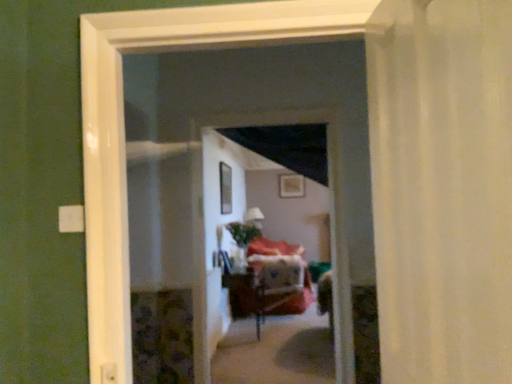
You are a GUI agent. You are given a task and a screenshot of the screen. Output one action in this format:
    pyautogui.click(x=<x>, y=<y>)
    Task: Click on the wooden table at center
    This screenshot has height=384, width=512.
    Given the screenshot: What is the action you would take?
    pyautogui.click(x=274, y=282)

What is the approximate width of wooden table at center?

The width of wooden table at center is 75.75 centimeters.

Where is `white sheer curtain at right`? Image resolution: width=512 pixels, height=384 pixels. white sheer curtain at right is located at coordinates tap(442, 187).

What do you see at coordinates (330, 220) in the screenshot? The width and height of the screenshot is (512, 384). I see `wooden screen door at center` at bounding box center [330, 220].

Identify the location of transparent glass window at center. (225, 188).

You are a GUI agent. You are given a task and a screenshot of the screen. Output one action in this format:
    pyautogui.click(x=<x>, y=<y>)
    Task: Click on the wooden table at center
    
    Given the screenshot: What is the action you would take?
    pyautogui.click(x=274, y=282)

Is green matte plant at center taller or shorter than wooden picture frame at upper center?

Considering their sizes, green matte plant at center has more height than wooden picture frame at upper center.

Based on the photo, in the image, is green matte plant at center positioned in front of or behind wooden picture frame at upper center?

green matte plant at center is positioned closer to the viewer than wooden picture frame at upper center.

Can we say green matte plant at center lies outside wooden picture frame at upper center?

Indeed, green matte plant at center is completely outside wooden picture frame at upper center.

Is point (227, 228) closer or farther from the camera than point (291, 190)?

Point (227, 228) is positioned closer to the camera compared to point (291, 190).

From a real-world perspective, is wooden picture frame at upper center beneath wooden screen door at center?

No.

Are wooden picture frame at upper center and wooden screen door at center beside each other?

They are not placed beside each other.

How far apart are wooden picture frame at upper center and wooden screen door at center?

wooden picture frame at upper center and wooden screen door at center are 3.59 meters apart from each other.

Is wooden screen door at center oriented away from transparent glass window at center?

Yes, wooden screen door at center is facing away from transparent glass window at center.

In terms of width, does wooden screen door at center look wider or thinner when compared to transparent glass window at center?

In the image, wooden screen door at center appears to be wider than transparent glass window at center.

Is wooden screen door at center to the left or to the right of transparent glass window at center in the image?

wooden screen door at center is to the right of transparent glass window at center.

Is wooden screen door at center taller than transparent glass window at center?

Indeed, wooden screen door at center has a greater height compared to transparent glass window at center.

Can you confirm if green matte plant at center is positioned to the right of wooden screen door at center?

No.

Which of these two, green matte plant at center or wooden screen door at center, is smaller?

green matte plant at center is smaller.

Locate an element on the screen. The height and width of the screenshot is (384, 512). plant behind the wooden screen door at center is located at coordinates (243, 232).

Could wooden screen door at center be considered to be inside green matte plant at center?

Actually, wooden screen door at center is outside green matte plant at center.

At what (x,y) coordinates should I click in order to perform the action: click on furniture below the white sheer curtain at right (from the image's perspective). Please return your answer as a coordinate pair (x, y). The width and height of the screenshot is (512, 384). Looking at the image, I should click on (274, 282).

Could you tell me if wooden table at center is turned towards white sheer curtain at right?

No, wooden table at center is not facing towards white sheer curtain at right.

Is wooden table at center directly adjacent to white sheer curtain at right?

No, wooden table at center is not next to white sheer curtain at right.

From the image's perspective, which one is positioned lower, wooden table at center or white sheer curtain at right?

wooden table at center.

Considering the positions of point (278, 291) and point (237, 117), is point (278, 291) closer or farther from the camera than point (237, 117)?

Clearly, point (278, 291) is more distant from the camera than point (237, 117).

Is wooden table at center with wooden screen door at center?

No, wooden table at center is not next to wooden screen door at center.

Would you say wooden screen door at center is part of wooden table at center's contents?

No, wooden table at center does not contain wooden screen door at center.

Considering the relative positions of green matte plant at center and transparent glass window at center in the image provided, is green matte plant at center to the left of transparent glass window at center from the viewer's perspective?

No, green matte plant at center is not to the left of transparent glass window at center.

From a real-world perspective, is green matte plant at center positioned over transparent glass window at center based on gravity?

No, from a real-world perspective, green matte plant at center is not over transparent glass window at center

How different are the orientations of green matte plant at center and transparent glass window at center in degrees?

They differ by 4.1 degrees in their facing directions.

Locate an element on the screen. The width and height of the screenshot is (512, 384). plant in front of the wooden picture frame at upper center is located at coordinates (243, 232).

This screenshot has height=384, width=512. What are the coordinates of `screen door on the left of wooden picture frame at upper center` in the screenshot? It's located at (330, 220).

Estimate the real-world distances between objects in this image. Which object is further from green matte plant at center, transparent glass window at center or white sheer curtain at right?

white sheer curtain at right is further to green matte plant at center.

When comparing their distances from wooden table at center, does wooden screen door at center or wooden picture frame at upper center seem further?

wooden screen door at center is further to wooden table at center.

When comparing their distances from transparent glass window at center, does wooden picture frame at upper center or white sheer curtain at right seem closer?

wooden picture frame at upper center is positioned closer to the anchor transparent glass window at center.

Estimate the real-world distances between objects in this image. Which object is further from green matte plant at center, wooden table at center or wooden picture frame at upper center?

Among the two, wooden picture frame at upper center is located further to green matte plant at center.

Based on their spatial positions, is wooden picture frame at upper center or wooden table at center further from white sheer curtain at right?

wooden picture frame at upper center is further to white sheer curtain at right.

Looking at the image, which one is located closer to transparent glass window at center, white sheer curtain at right or wooden table at center?

Among the two, wooden table at center is located nearer to transparent glass window at center.

Estimate the real-world distances between objects in this image. Which object is further from green matte plant at center, wooden screen door at center or transparent glass window at center?

wooden screen door at center is further to green matte plant at center.

From the image, which object appears to be nearer to wooden screen door at center, green matte plant at center or transparent glass window at center?

transparent glass window at center is positioned closer to the anchor wooden screen door at center.

The height and width of the screenshot is (384, 512). What are the coordinates of `plant between white sheer curtain at right and wooden picture frame at upper center from front to back` in the screenshot? It's located at (243, 232).

Identify the location of window between white sheer curtain at right and wooden picture frame at upper center in the front-back direction. This screenshot has height=384, width=512. (225, 188).

Where is `screen door between white sheer curtain at right and transparent glass window at center from front to back`? This screenshot has height=384, width=512. screen door between white sheer curtain at right and transparent glass window at center from front to back is located at coordinates (330, 220).

The image size is (512, 384). What are the coordinates of `plant positioned between white sheer curtain at right and wooden table at center from near to far` in the screenshot? It's located at (243, 232).